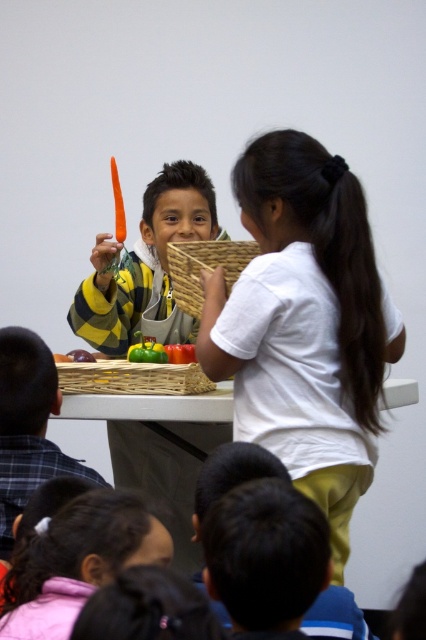
You are standing in the classroom and want to hand a note to the child wearing the white matte shirt at upper center. Based on their position in the image, where should you look to find them?

The white matte shirt at upper center is located at the 2D coordinates point (305,324) in the image, so you should look towards that point to find them.

You are a teacher in the classroom and want to place a new poster on the wall behind the woven bamboo tray at center and the green matte pepper at center. Which object should you place the poster behind so that it is closer to the front of the room?

The woven bamboo tray at center is in front of the green matte pepper at center, so placing the poster behind the green matte pepper at center would position it closer to the front of the room.